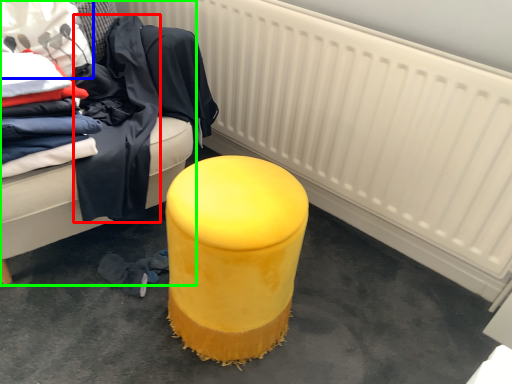
Question: Which is farther away from clothing (highlighted by a red box)? clothing (highlighted by a blue box) or furniture (highlighted by a green box)?

Choices:
 (A) clothing
 (B) furniture

Answer: (A)